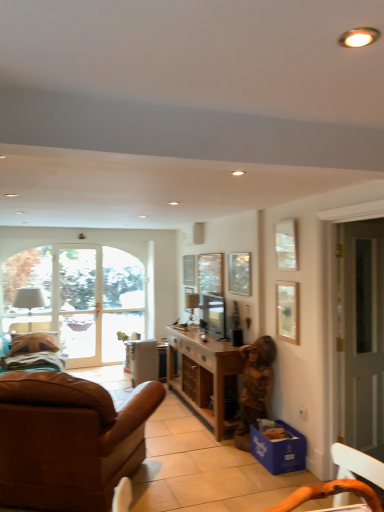
Question: Are wooden picture frame at upper center, arranged as the 1th picture frame when viewed from the back, and blue cardboard box at lower right beside each other?

Choices:
 (A) yes
 (B) no

Answer: (B)

Question: From a real-world perspective, is wooden picture frame at upper center, arranged as the 1th picture frame when viewed from the back, on top of blue cardboard box at lower right?

Choices:
 (A) no
 (B) yes

Answer: (B)

Question: Can you confirm if wooden picture frame at upper center, which ranks as the 1th picture frame in left-to-right order, is thinner than blue cardboard box at lower right?

Choices:
 (A) no
 (B) yes

Answer: (B)

Question: Considering the relative sizes of wooden picture frame at upper center, the 3th picture frame when ordered from right to left, and blue cardboard box at lower right in the image provided, is wooden picture frame at upper center, the 3th picture frame when ordered from right to left, wider than blue cardboard box at lower right?

Choices:
 (A) no
 (B) yes

Answer: (A)

Question: Is wooden picture frame at upper center, which appears as the third picture frame when viewed from the front, aimed at blue cardboard box at lower right?

Choices:
 (A) yes
 (B) no

Answer: (B)

Question: Does wooden picture frame at upper center, the 3th picture frame when ordered from right to left, have a larger size compared to blue cardboard box at lower right?

Choices:
 (A) no
 (B) yes

Answer: (A)

Question: Considering the relative sizes of matte black speaker at center and clear glass door at center in the image provided, is matte black speaker at center taller than clear glass door at center?

Choices:
 (A) no
 (B) yes

Answer: (A)

Question: Considering the relative sizes of matte black speaker at center and clear glass door at center in the image provided, is matte black speaker at center shorter than clear glass door at center?

Choices:
 (A) yes
 (B) no

Answer: (A)

Question: Considering the relative positions of matte black speaker at center and clear glass door at center in the image provided, is matte black speaker at center in front of clear glass door at center?

Choices:
 (A) yes
 (B) no

Answer: (A)

Question: Considering the relative positions of matte black speaker at center and clear glass door at center in the image provided, is matte black speaker at center to the left of clear glass door at center from the viewer's perspective?

Choices:
 (A) no
 (B) yes

Answer: (A)

Question: From the image's perspective, is matte black speaker at center over clear glass door at center?

Choices:
 (A) no
 (B) yes

Answer: (A)

Question: Does matte black speaker at center appear on the right side of clear glass door at center?

Choices:
 (A) yes
 (B) no

Answer: (A)

Question: Can you confirm if clear glass window screen at center is wider than wooden cabinet at center?

Choices:
 (A) no
 (B) yes

Answer: (A)